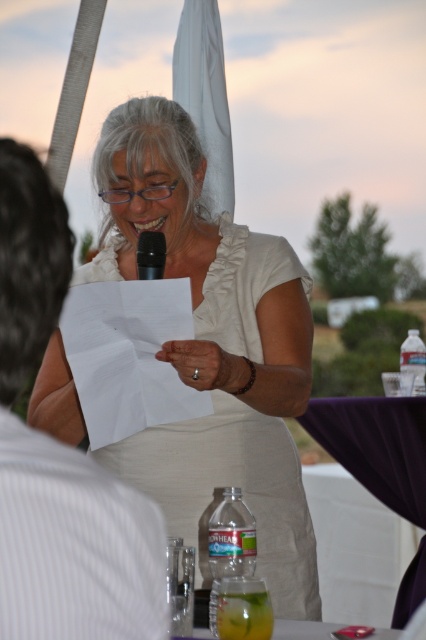
You are a photographer at the event and want to capture a clear shot of the white satin dress at center and the black matte microphone at center. Since the dress is in front, will you need to adjust your camera angle to see both items clearly in the photo?

The white satin dress at center is in front of the black matte microphone at center, so you will need to adjust your camera angle to ensure both items are visible in the photo.

Consider the image. You are a photographer at the event and need to position a light to illuminate the white satin dress at center. According to the coordinates provided, where should you place the light relative to the dress?

The white satin dress at center is located at point (213,348), so you should place the light directly above or slightly in front of that coordinate to ensure proper illumination.